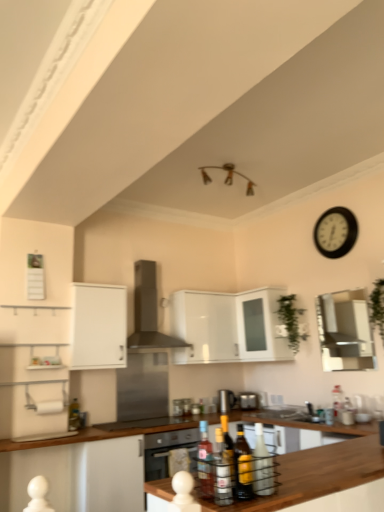
Where is `free spot to the right of translucent glass bottle at center, the 1th bottle in the right-to-left sequence`? This screenshot has height=512, width=384. free spot to the right of translucent glass bottle at center, the 1th bottle in the right-to-left sequence is located at coordinates (289, 488).